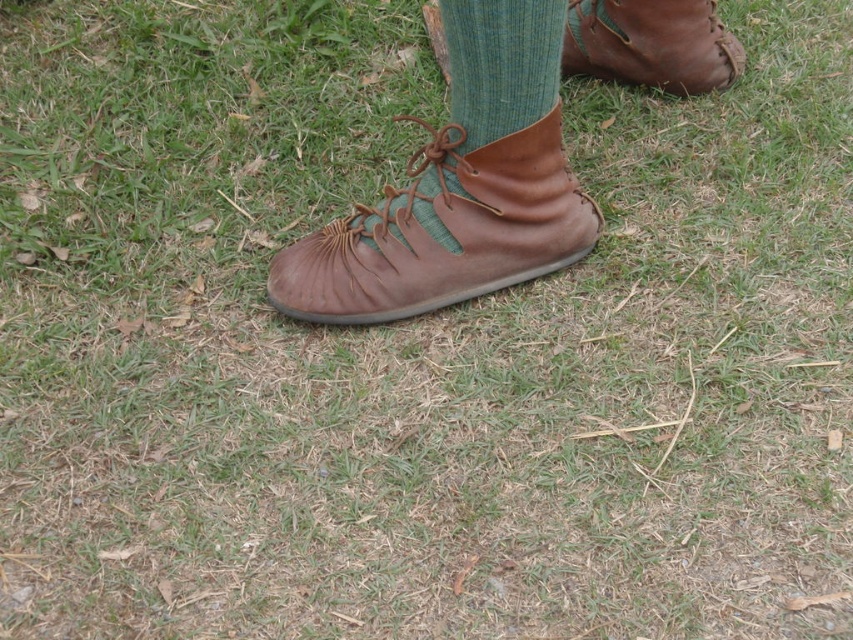
Question: Is brown leather boot at center below green knitted sock at center?

Choices:
 (A) yes
 (B) no

Answer: (A)

Question: Does brown leather boot at center have a greater width compared to brown leather boot at upper right?

Choices:
 (A) no
 (B) yes

Answer: (B)

Question: Which object appears farthest from the camera in this image?

Choices:
 (A) brown leather boot at upper right
 (B) brown leather boot at center
 (C) green knitted sock at center

Answer: (A)

Question: Which point appears farthest from the camera in this image?

Choices:
 (A) (447, 20)
 (B) (572, 52)

Answer: (B)

Question: Which point appears farthest from the camera in this image?

Choices:
 (A) (444, 204)
 (B) (625, 36)

Answer: (B)

Question: Does green knitted sock at center have a smaller size compared to brown leather boot at upper right?

Choices:
 (A) yes
 (B) no

Answer: (B)